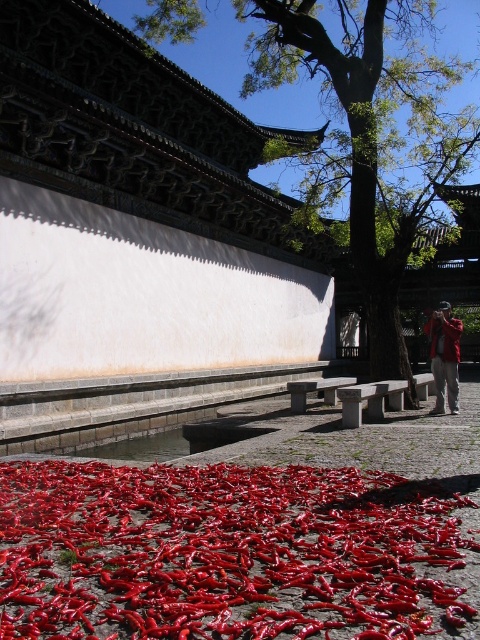
Question: Which of the following is the closest to the observer?

Choices:
 (A) (301, 499)
 (B) (255, 12)

Answer: (A)

Question: Which is farther from the red matte pepper at lower center?

Choices:
 (A) red fabric jacket at lower right
 (B) green leafy tree at upper center

Answer: (B)

Question: Does red matte pepper at lower center have a larger size compared to green leafy tree at upper center?

Choices:
 (A) no
 (B) yes

Answer: (A)

Question: Does red matte pepper at lower center appear on the right side of red fabric jacket at lower right?

Choices:
 (A) yes
 (B) no

Answer: (B)

Question: Is red matte pepper at lower center bigger than red fabric jacket at lower right?

Choices:
 (A) no
 (B) yes

Answer: (A)

Question: Which object appears closest to the camera in this image?

Choices:
 (A) green leafy tree at upper center
 (B) red fabric jacket at lower right
 (C) red matte pepper at lower center

Answer: (C)